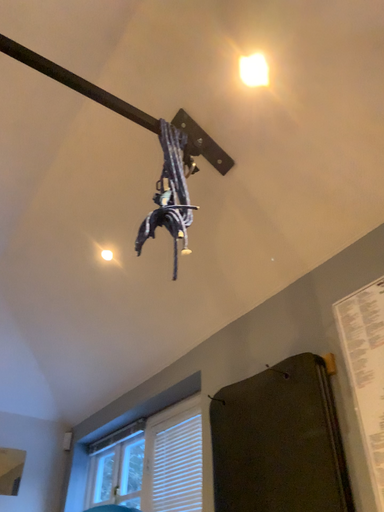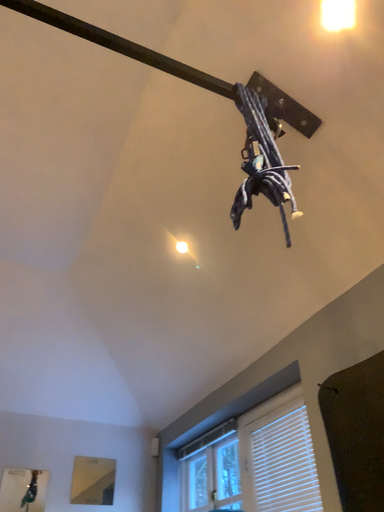
Question: How did the camera likely rotate when shooting the video?

Choices:
 (A) rotated right
 (B) rotated left

Answer: (B)